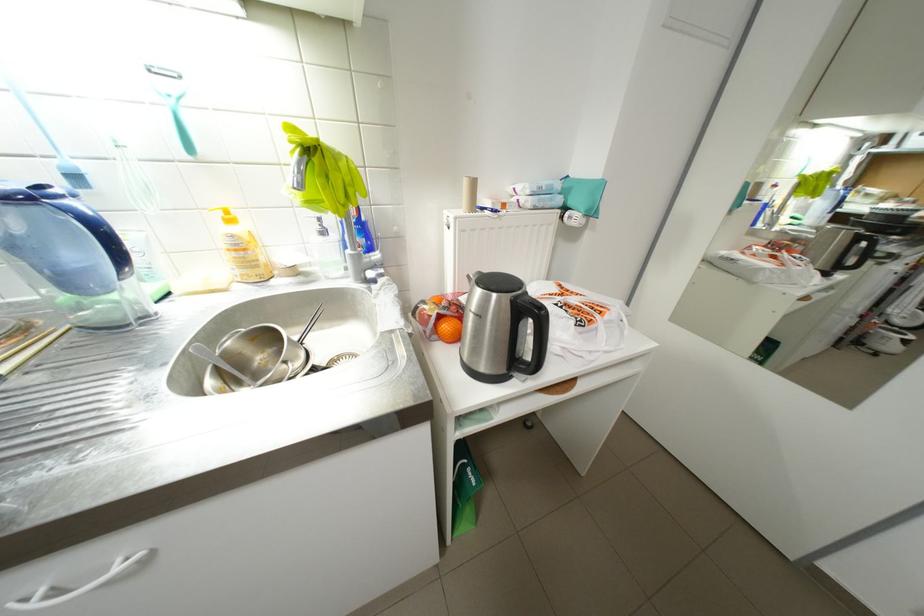
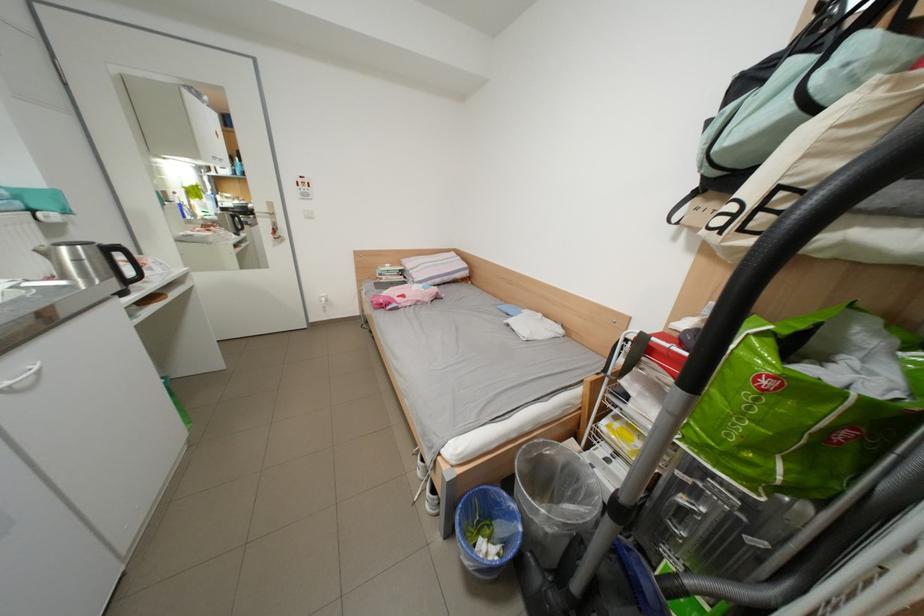
Locate, in the second image, the point that corresponds to point 128,570 in the first image.

(46, 369)